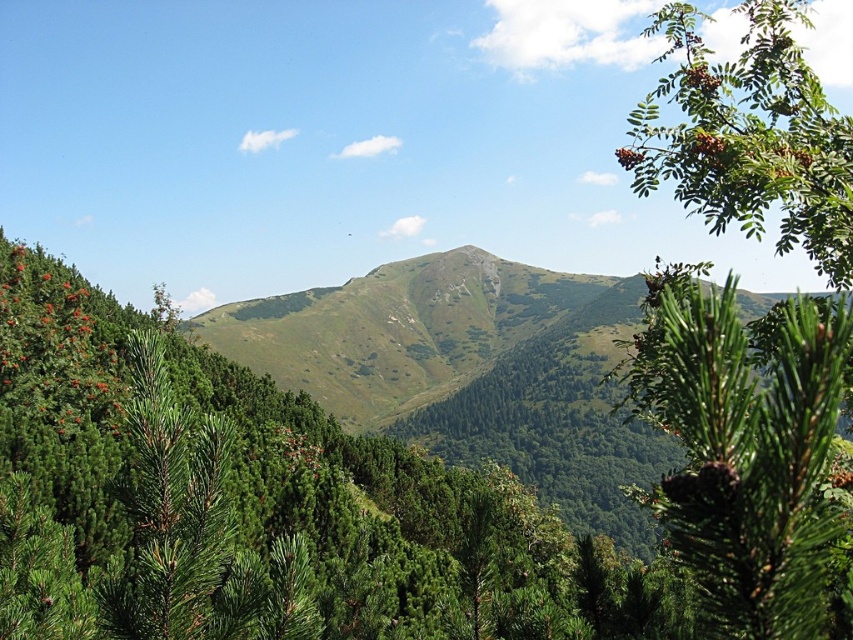
You are standing at the point marked as point (x=368, y=492) in the image. What type of tree are you facing? Please refer to the scene description for context.

The point (x=368, y=492) indicates a green needle like tree at center, so you are facing a green needle like tree.